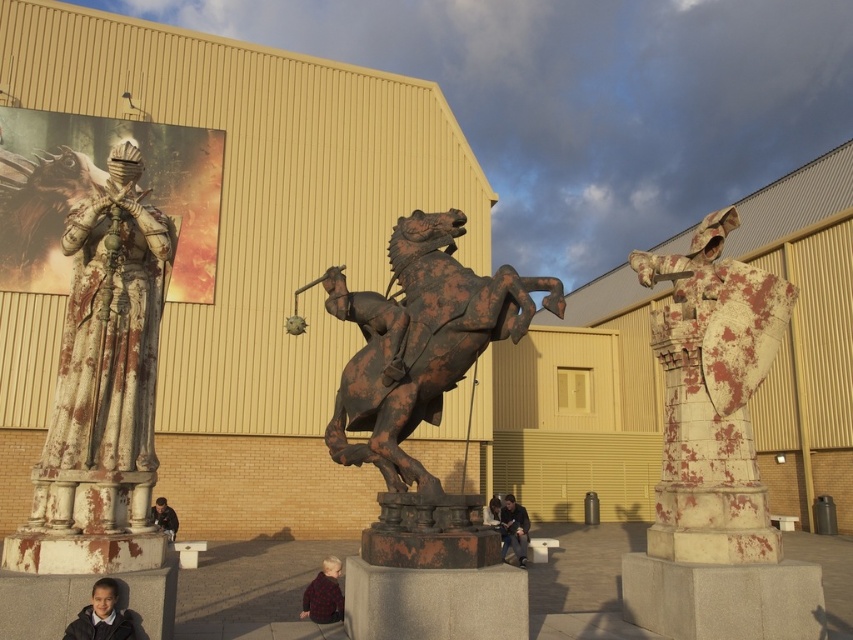
Question: Which point is farther to the camera?

Choices:
 (A) dark brown leather jacket at center
 (B) plaid wool sweater at lower center
 (C) rusty metal horseman at center

Answer: (A)

Question: Which point is closer to the camera?

Choices:
 (A) (525, 547)
 (B) (463, 339)
 (C) (492, 509)
 (D) (328, 580)

Answer: (B)

Question: Is rusty stone knight at right below dark gray fabric jacket at center?

Choices:
 (A) no
 (B) yes

Answer: (A)

Question: Which point is closer to the camera taking this photo?

Choices:
 (A) (483, 284)
 (B) (517, 509)
 (C) (125, 307)

Answer: (C)

Question: Is plaid wool sweater at lower center wider than dark brown leather jacket at center?

Choices:
 (A) no
 (B) yes

Answer: (A)

Question: Is rusty metal horseman at center to the left of dark brown leather jacket at lower left from the viewer's perspective?

Choices:
 (A) yes
 (B) no

Answer: (B)